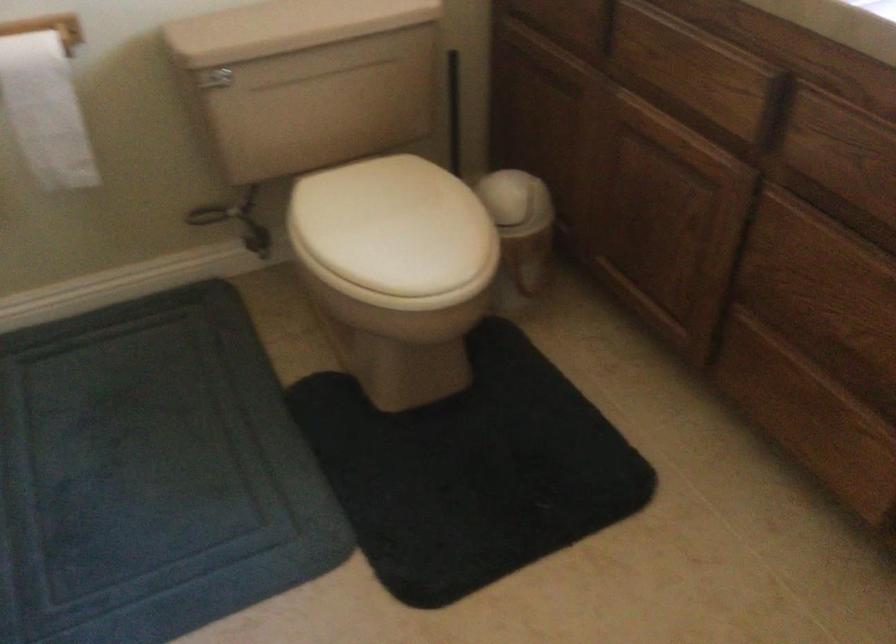
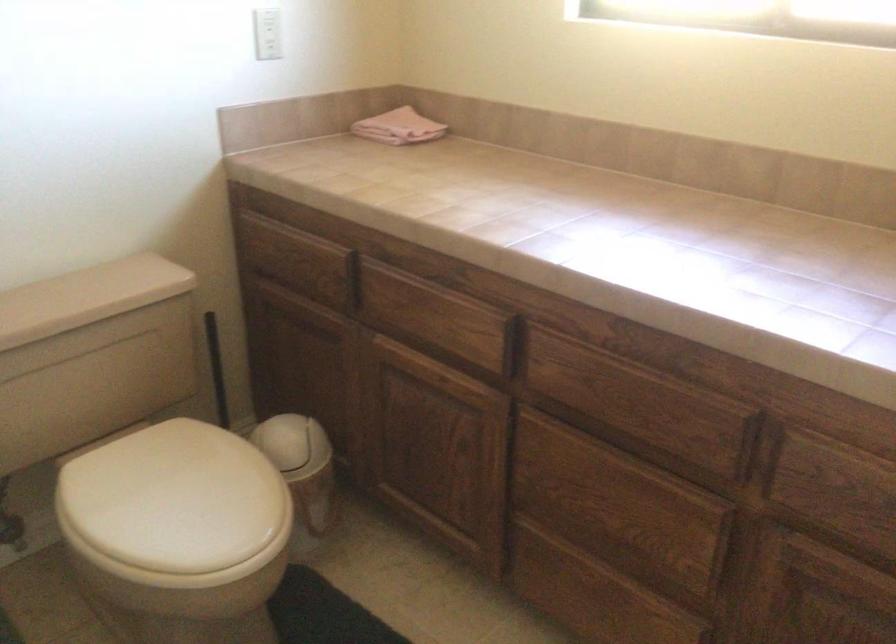
Question: Based on the continuous images, in which direction is the camera rotating? Reply with the corresponding letter.

Choices:
 (A) Left
 (B) Right
 (C) Up
 (D) Down

Answer: (B)